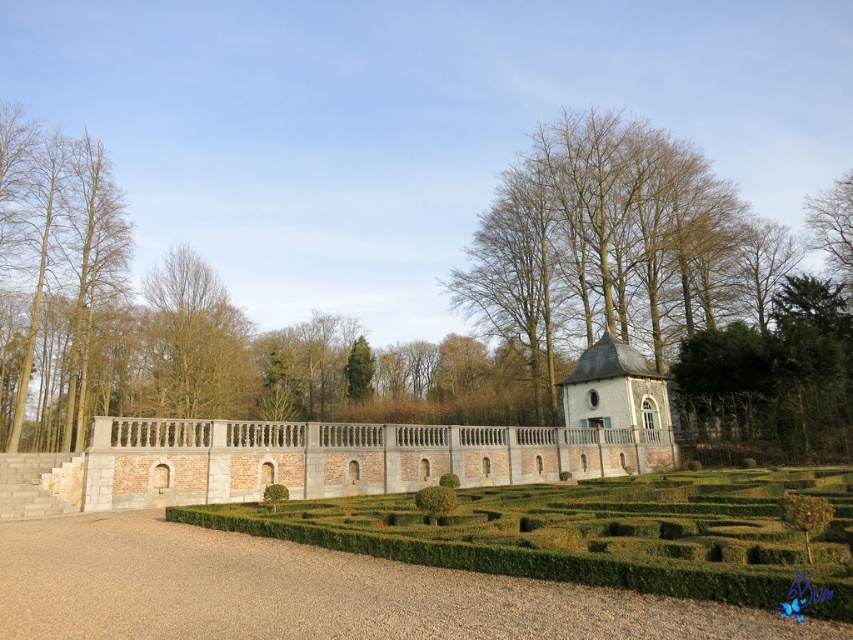
Who is shorter, green hedge maze at center or green textured tree at center?

green hedge maze at center is shorter.

Is green hedge maze at center positioned behind green textured tree at center?

No, it is not.

Locate an element on the screen. green hedge maze at center is located at coordinates (595, 532).

Locate an element on the screen. green hedge maze at center is located at coordinates (595, 532).

Based on the photo, who is higher up, green hedge maze at center or green leafy tree at center?

green leafy tree at center is higher up.

Who is more forward, (309, 529) or (231, 410)?

Point (309, 529) is in front.

Locate an element on the screen. Image resolution: width=853 pixels, height=640 pixels. green hedge maze at center is located at coordinates (595, 532).

Can you confirm if green leafy tree at center is shorter than white brick gazebo at center-right?

In fact, green leafy tree at center may be taller than white brick gazebo at center-right.

Does green leafy tree at center appear over white brick gazebo at center-right?

Correct, green leafy tree at center is located above white brick gazebo at center-right.

What do you see at coordinates (195, 340) in the screenshot? This screenshot has height=640, width=853. I see `green leafy tree at center` at bounding box center [195, 340].

Where is `green leafy tree at center`? This screenshot has height=640, width=853. green leafy tree at center is located at coordinates (195, 340).